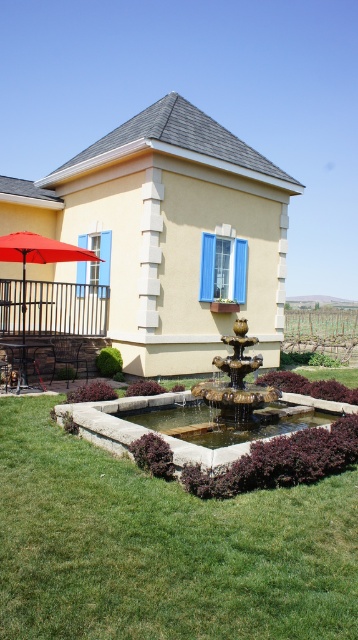
You are standing in front of the building and want to place a new decorative statue. The statue is 1.2 meters tall. The gold metallic fountain at center is 1.5 meters tall. Can the statue be placed near the fountain without blocking the view of the red matte umbrella at left?

The gold metallic fountain at center is closer to the viewer than the red matte umbrella at left. Since the fountain is 1.5 meters tall and the statue is only 1.2 meters, placing the statue near the fountain might block the view of the umbrella if they are aligned. Ensure the statue is positioned to the side or behind the fountain to maintain visibility of the umbrella.

You are planning to place a new decorative statue that is 2 meters wide in the garden. The statue needs to be placed between the green grass at lower center and the clear stone fountain at center. Based on the scene description, can the statue fit in that space?

The green grass at lower center might be wider than the clear stone fountain at center, but without exact measurements, it is uncertain if the space between them can accommodate a 2 meter wide statue. Further measurements are needed to confirm.

You are standing in front of the building and want to walk towards the gold metallic fountain at center. Which direction should you walk to avoid stepping on the green grass at lower center?

The green grass at lower center is located below the gold metallic fountain at center, so to avoid stepping on it, you should walk around the fountain to the left or right side instead of going straight towards it from above.